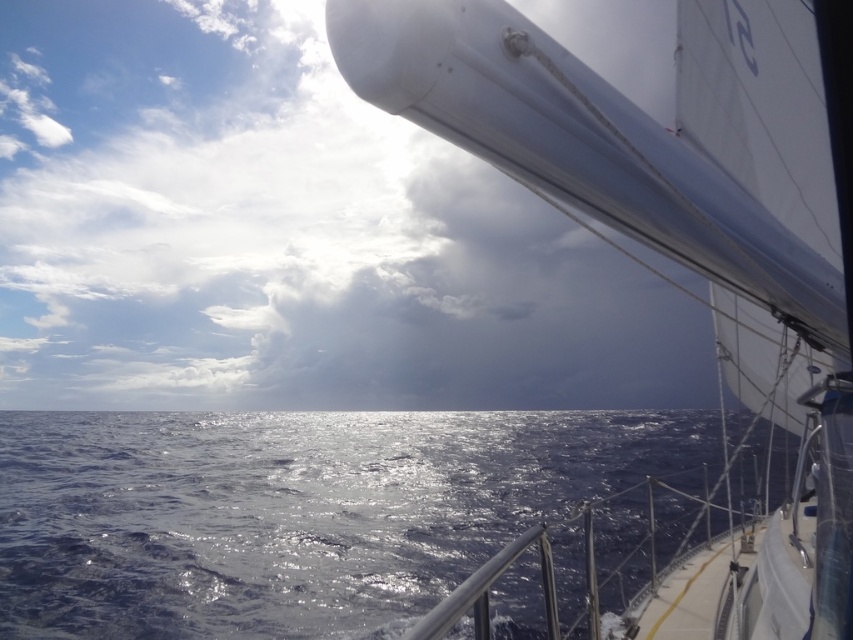
You are a sailor on the deck of a ship and you see the white glossy sailboat at upper right and the glistening blue water at center. Which object is located above the other?

The white glossy sailboat at upper right is positioned over glistening blue water at center.

You are standing on the deck of the ship and see two points on the deck. The first point is at coordinates point (724, 276) and the second is at point (15, 592). Which point is closer to the bow of the ship?

Point (724, 276) is in front of point (15, 592), so the first point is closer to the bow of the ship.